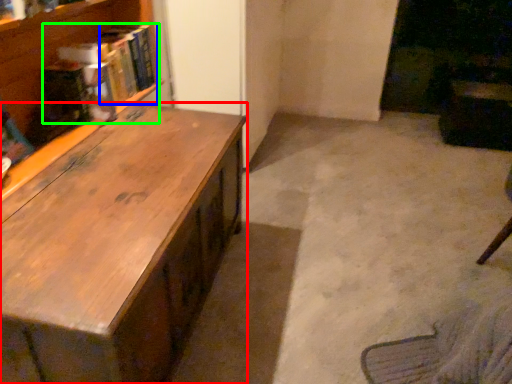
Question: Which object is positioned farthest from desk (highlighted by a red box)? Select from book (highlighted by a blue box) and book (highlighted by a green box).

Choices:
 (A) book
 (B) book

Answer: (A)